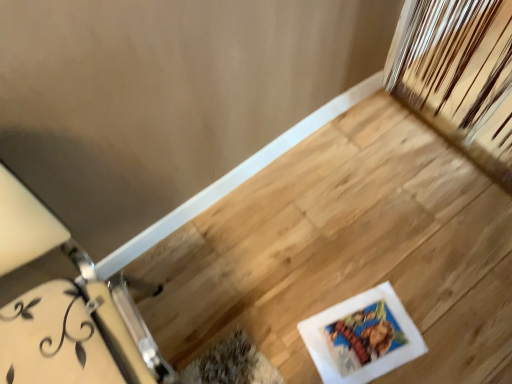
In order to click on free space to the right of white glossy picture frame at lower right in this screenshot , I will do `click(455, 311)`.